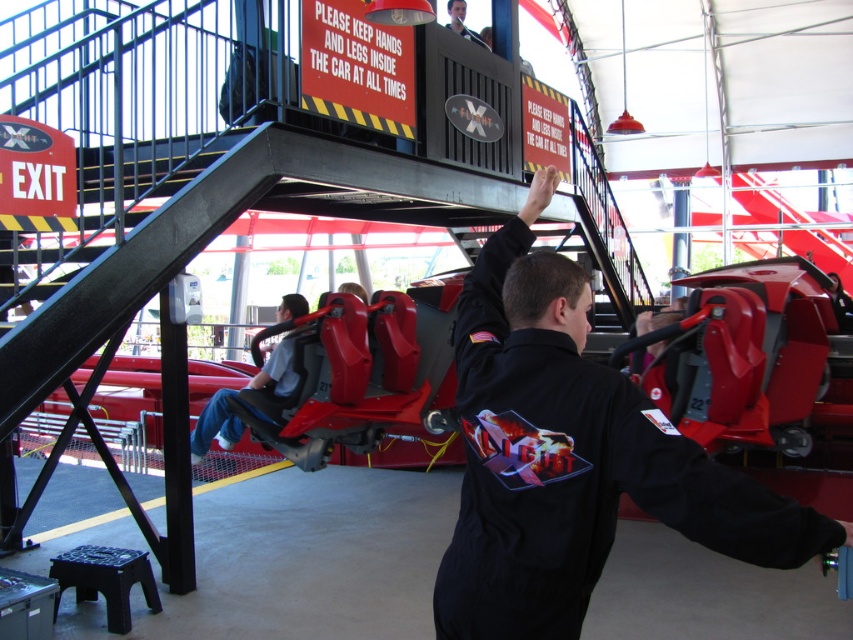
You are a visitor at the amusement park and want to board the roller coaster. You see the black matte uniform at center and the gray fabric seat at lower center. Which object is taller?

The black matte uniform at center is much taller than the gray fabric seat at lower center.

You are a guest at the amusement park and you see two staff members wearing the black matte uniform at center and the smooth black shirt at center. You need to find the one with the bigger uniform to ask for assistance. Which staff member should you approach?

The black matte uniform at center has a larger size compared to the smooth black shirt at center, so you should approach the staff member wearing the black matte uniform at center.